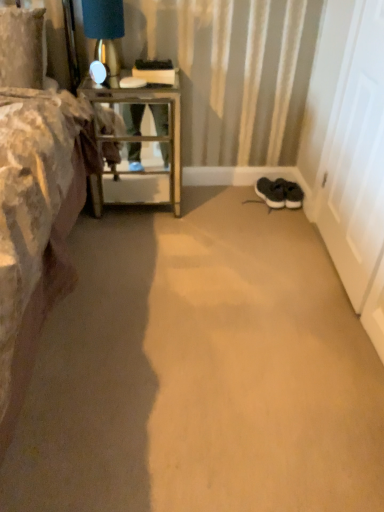
Locate an element on the screen. Image resolution: width=384 pixels, height=512 pixels. vacant area to the left of black suede sneakers at lower right is located at coordinates (239, 195).